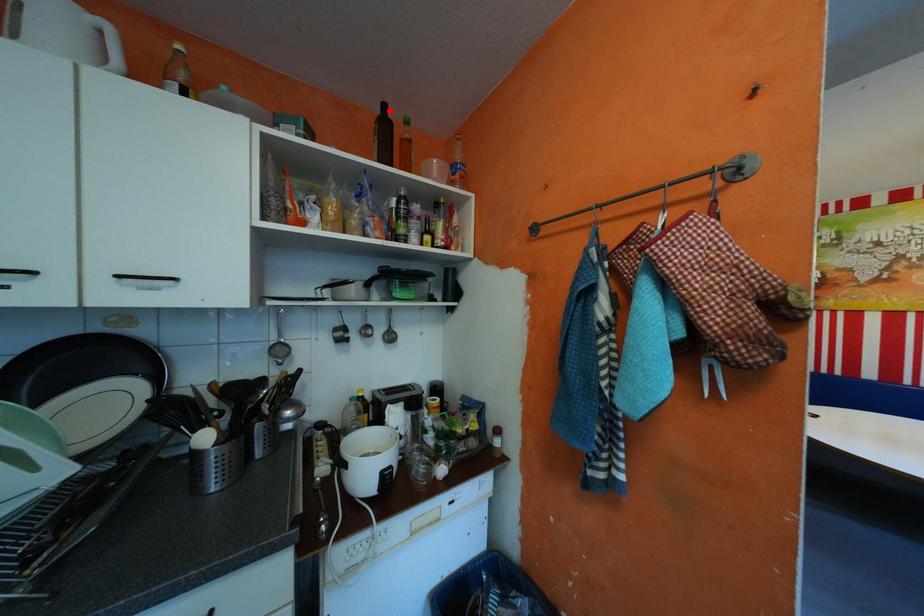
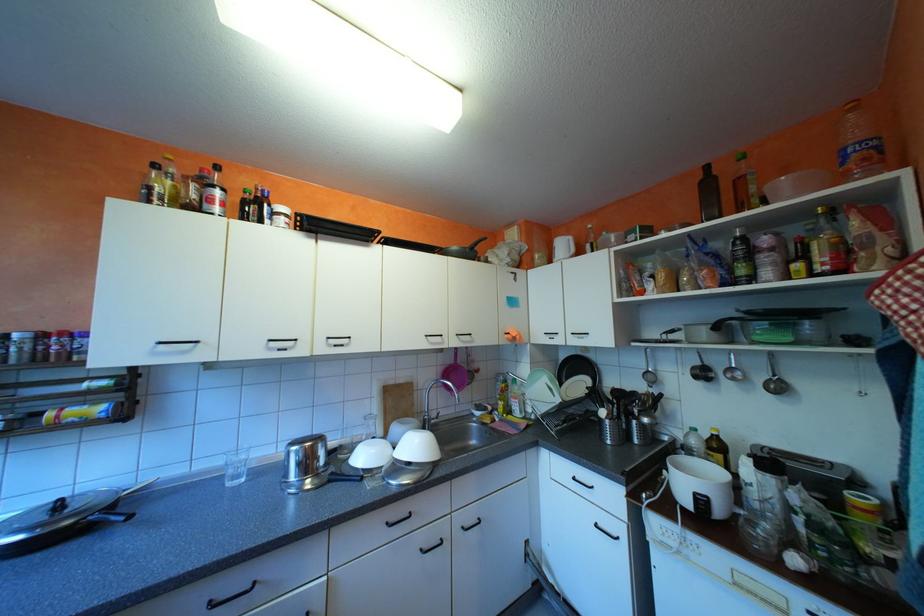
The point at the highlighted location is marked in the first image. Where is the corresponding point in the second image?

(711, 176)